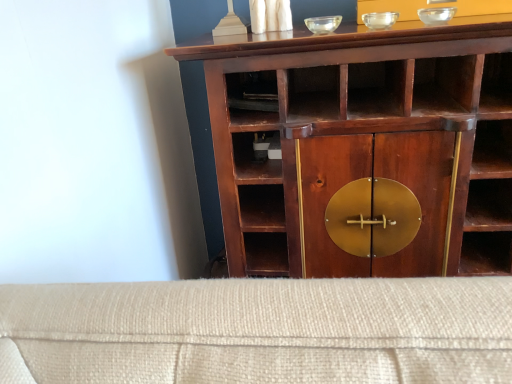
Question: Is transparent glass bowl at upper center, acting as the second glass bowl starting from the left, completely or partially inside transparent glass bowl at upper center, marked as the first glass bowl in a left-to-right arrangement?

Choices:
 (A) no
 (B) yes

Answer: (A)

Question: Is transparent glass bowl at upper center, acting as the 3th glass bowl starting from the right, closer to camera compared to transparent glass bowl at upper center, positioned as the 2th glass bowl in right-to-left order?

Choices:
 (A) yes
 (B) no

Answer: (B)

Question: Is transparent glass bowl at upper center, acting as the 3th glass bowl starting from the right, shorter than transparent glass bowl at upper center, positioned as the 2th glass bowl in right-to-left order?

Choices:
 (A) no
 (B) yes

Answer: (B)

Question: Can you confirm if transparent glass bowl at upper center, acting as the 3th glass bowl starting from the right, is taller than transparent glass bowl at upper center, acting as the second glass bowl starting from the left?

Choices:
 (A) yes
 (B) no

Answer: (B)

Question: Does transparent glass bowl at upper center, marked as the first glass bowl in a left-to-right arrangement, appear on the right side of transparent glass bowl at upper center, positioned as the 2th glass bowl in right-to-left order?

Choices:
 (A) yes
 (B) no

Answer: (B)

Question: Looking at the image, does transparent glass bowl at upper center, acting as the 3th glass bowl starting from the right, seem bigger or smaller compared to transparent glass bowl at upper center, positioned as the 2th glass bowl in right-to-left order?

Choices:
 (A) small
 (B) big

Answer: (A)

Question: Considering their positions, is transparent glass bowl at upper center, marked as the first glass bowl in a left-to-right arrangement, located in front of or behind transparent glass bowl at upper center, acting as the second glass bowl starting from the left?

Choices:
 (A) front
 (B) behind

Answer: (B)

Question: From a real-world perspective, relative to transparent glass bowl at upper center, acting as the second glass bowl starting from the left, is transparent glass bowl at upper center, marked as the first glass bowl in a left-to-right arrangement, vertically above or below?

Choices:
 (A) above
 (B) below

Answer: (B)

Question: Does point click(329, 23) appear closer or farther from the camera than point click(379, 11)?

Choices:
 (A) closer
 (B) farther

Answer: (B)

Question: Choose the correct answer: Is mahogany wood cupboard at center inside transparent glass bowl at upper center, marked as the first glass bowl in a left-to-right arrangement, or outside it?

Choices:
 (A) outside
 (B) inside

Answer: (A)

Question: From the image's perspective, is mahogany wood cupboard at center above or below transparent glass bowl at upper center, acting as the 3th glass bowl starting from the right?

Choices:
 (A) above
 (B) below

Answer: (B)

Question: Visually, is mahogany wood cupboard at center positioned to the left or to the right of transparent glass bowl at upper center, marked as the first glass bowl in a left-to-right arrangement?

Choices:
 (A) right
 (B) left

Answer: (A)

Question: From a real-world perspective, is mahogany wood cupboard at center positioned above or below transparent glass bowl at upper center, marked as the first glass bowl in a left-to-right arrangement?

Choices:
 (A) above
 (B) below

Answer: (B)

Question: Is mahogany wood cupboard at center spatially inside transparent glass bowl at upper center, acting as the second glass bowl starting from the left, or outside of it?

Choices:
 (A) outside
 (B) inside

Answer: (A)

Question: Is mahogany wood cupboard at center in front of or behind transparent glass bowl at upper center, positioned as the 2th glass bowl in right-to-left order, in the image?

Choices:
 (A) behind
 (B) front

Answer: (B)